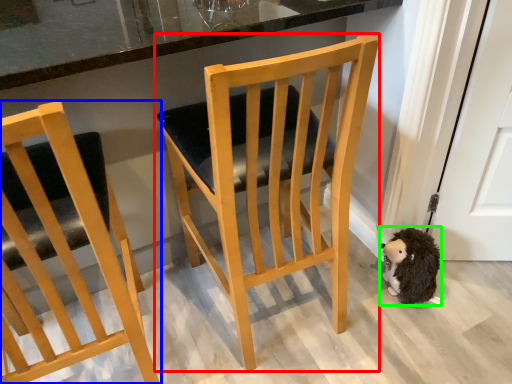
Question: Which object is positioned farthest from chair (highlighted by a red box)? Select from chair (highlighted by a blue box) and animal (highlighted by a green box).

Choices:
 (A) chair
 (B) animal

Answer: (B)